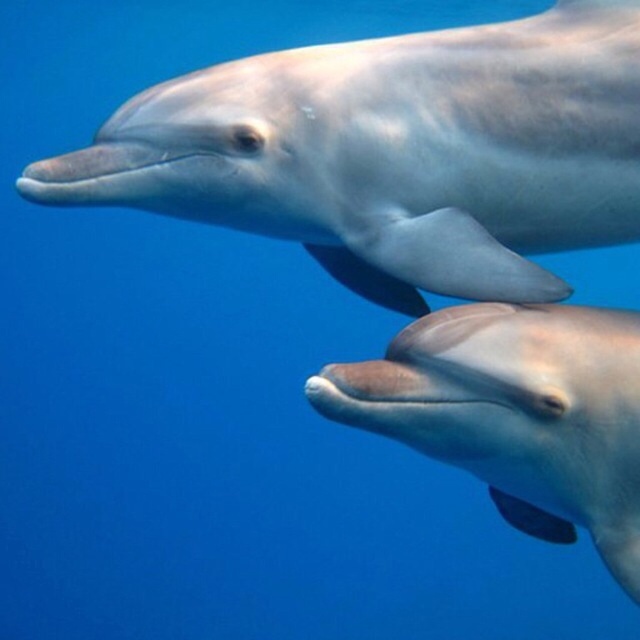
Does sleek silver dolphin at upper center have a greater width compared to smooth gray dolphin at center?

Yes.

Is sleek silver dolphin at upper center further to camera compared to smooth gray dolphin at center?

Yes, it is behind smooth gray dolphin at center.

Locate an element on the screen. This screenshot has width=640, height=640. sleek silver dolphin at upper center is located at coordinates (394, 152).